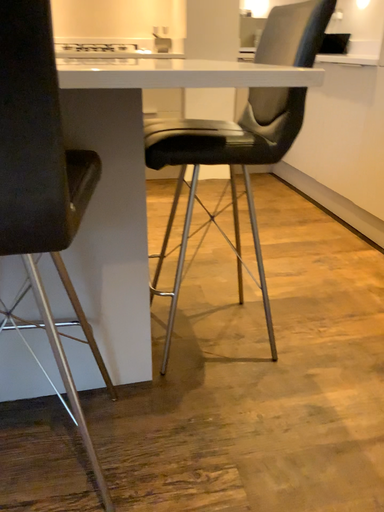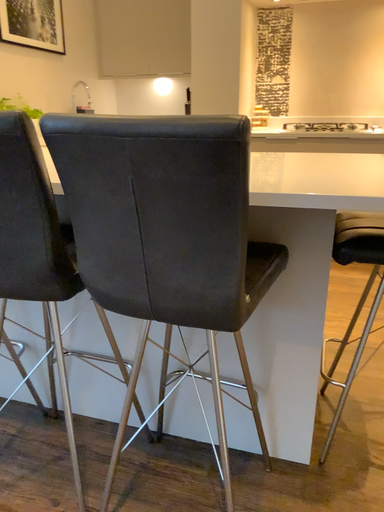
Question: Which way did the camera rotate in the video?

Choices:
 (A) rotated upward
 (B) rotated downward

Answer: (A)